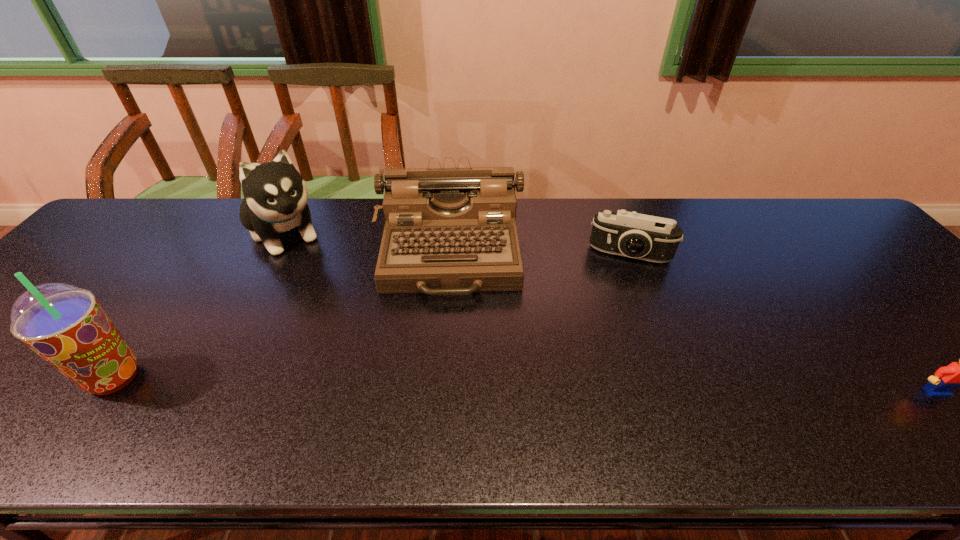
Identify the location of empty space between the shortest object and the smoothie. The height and width of the screenshot is (540, 960). (525, 385).

Locate an element on the screen. free space between the Lego and the typewriter is located at coordinates (692, 322).

The image size is (960, 540). Identify the location of unoccupied area between the smoothie and the typewriter. (282, 315).

What are the coordinates of `free space between the shortest object and the fourth object from left to right` in the screenshot? It's located at (782, 322).

At what (x,y) coordinates should I click in order to perform the action: click on free space between the leftmost object and the shortest object. Please return your answer as a coordinate pair (x, y). This screenshot has height=540, width=960. Looking at the image, I should click on (525, 385).

The height and width of the screenshot is (540, 960). Find the location of `vacant space that is in between the rightmost object and the fourth object from right to left`. vacant space that is in between the rightmost object and the fourth object from right to left is located at coordinates [x=611, y=312].

At what (x,y) coordinates should I click in order to perform the action: click on vacant space in between the second object from right to left and the third tallest object. Please return your answer as a coordinate pair (x, y). The image size is (960, 540). Looking at the image, I should click on (540, 253).

Identify the location of free space between the Lego and the camera. (782, 322).

Locate which object is the second closest to the smoothie. Please provide its 2D coordinates. Your answer should be formatted as a tuple, i.e. [(x, y)], where the tuple contains the x and y coordinates of a point satisfying the conditions above.

[(448, 231)]

You are a GUI agent. You are given a task and a screenshot of the screen. Output one action in this format:
    pyautogui.click(x=<x>, y=<y>)
    Task: Click on the object that is the fourth nearest to the smoothie
    Image resolution: width=960 pixels, height=540 pixels.
    Given the screenshot: What is the action you would take?
    pyautogui.click(x=957, y=374)